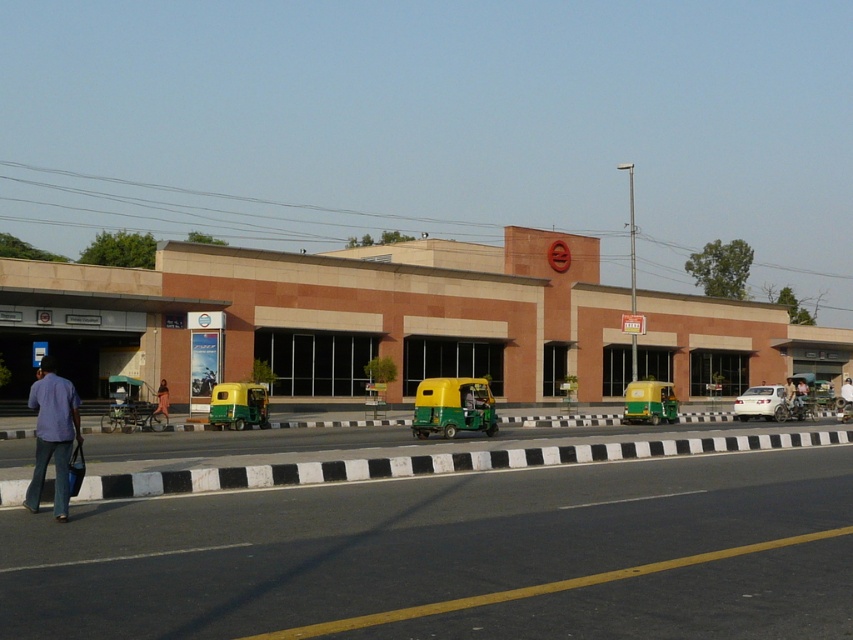
Consider the image. Can you confirm if brick building at center is bigger than black rubber barrier at lower left?

Correct, brick building at center is larger in size than black rubber barrier at lower left.

Between brick building at center and black rubber barrier at lower left, which one has more height?

With more height is brick building at center.

The image size is (853, 640). I want to click on brick building at center, so click(x=325, y=320).

Find the location of a particular element. The width and height of the screenshot is (853, 640). brick building at center is located at coordinates (325, 320).

From the picture: Is black rubber barrier at lower left below white fabric shirt at center?

Incorrect, black rubber barrier at lower left is not positioned below white fabric shirt at center.

Is point (753, 445) closer to viewer compared to point (846, 378)?

Yes, it is in front of point (846, 378).

You are a GUI agent. You are given a task and a screenshot of the screen. Output one action in this format:
    pyautogui.click(x=<x>, y=<y>)
    Task: Click on the black rubber barrier at lower left
    
    Given the screenshot: What is the action you would take?
    pyautogui.click(x=428, y=465)

What do you see at coordinates (325, 320) in the screenshot?
I see `brick building at center` at bounding box center [325, 320].

Is point (65, 372) in front of point (843, 392)?

Yes, point (65, 372) is closer to viewer.

The height and width of the screenshot is (640, 853). In order to click on brick building at center in this screenshot , I will do `click(325, 320)`.